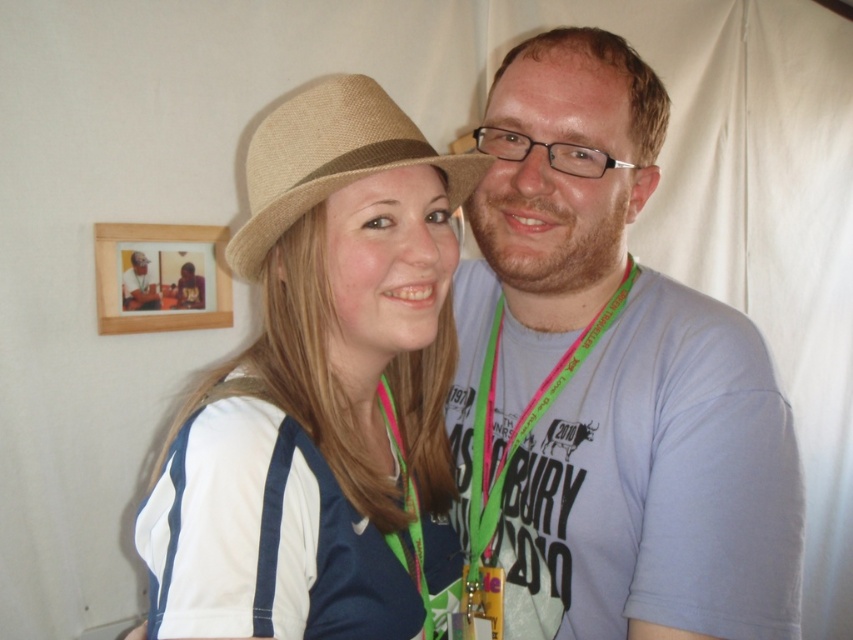
In the scene shown: You are standing in front of the image and want to point to the exact center of the matte straw hat at center. According to the coordinates given, where should you aim your finger?

The exact center of the matte straw hat at center is located at the coordinates point (318, 396).